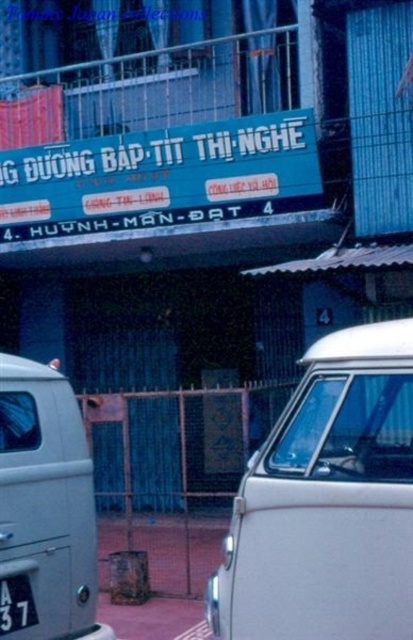
Looking at this image, you are a delivery driver who needs to park your vehicle between the white matte van at center and the silver metallic van at left. Given that the parking space between them is only 1.2 meters wide, can your 1.5 meters wide delivery van fit?

The white matte van at center is located above the silver metallic van at left, meaning they are not parked side by side. Therefore, the parking space between them is vertical, not horizontal, so the width of the delivery van is irrelevant. The driver should look for a different parking spot.

In the scene shown: You are a delivery driver with a van that is 2.5 meters wide. You see the white matte van at center in the street. Can your van pass through the space next to it?

The distance between the white matte van at center and the other object is 3.34 meters. Since your van is 2.5 meters wide, there is enough space to pass through the space next to the white matte van at center.

From the picture: You are a delivery person who needs to park your white matte van at center in a parking spot that requires vehicles to be no taller than the height of the black metal license plate at lower left. Based on the scene, can your van fit in the parking spot?

The white matte van at center is much taller than the black metal license plate at lower left, so it cannot fit in the parking spot.